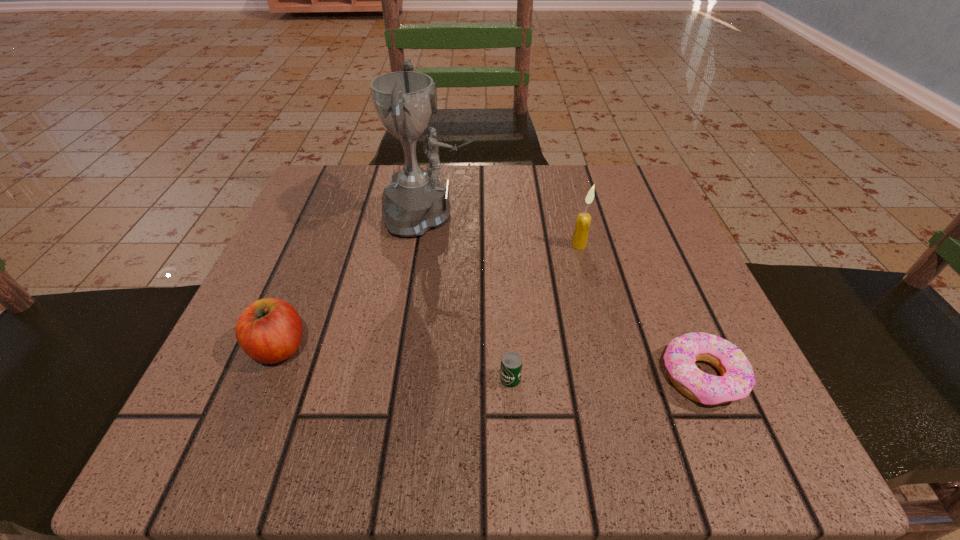
Where is `vacant space in between the doughnut and the apple`? This screenshot has height=540, width=960. vacant space in between the doughnut and the apple is located at coordinates (491, 362).

Where is `free point between the beer can and the doughnut`? Image resolution: width=960 pixels, height=540 pixels. free point between the beer can and the doughnut is located at coordinates (606, 378).

This screenshot has width=960, height=540. In order to click on free space between the candle and the tallest object in this screenshot , I will do click(x=505, y=231).

The width and height of the screenshot is (960, 540). What are the coordinates of `vacant space that's between the award and the doughnut` in the screenshot? It's located at (566, 296).

Where is `free area in between the beer can and the third shortest object`? The image size is (960, 540). free area in between the beer can and the third shortest object is located at coordinates (395, 363).

You are a GUI agent. You are given a task and a screenshot of the screen. Output one action in this format:
    pyautogui.click(x=<x>, y=<y>)
    Task: Click on the closest object to the leftmost object
    This screenshot has height=540, width=960.
    Given the screenshot: What is the action you would take?
    pyautogui.click(x=416, y=201)

Identify which object is the nearest to the candle. Please provide its 2D coordinates. Your answer should be formatted as a tuple, i.e. [(x, y)], where the tuple contains the x and y coordinates of a point satisfying the conditions above.

[(416, 201)]

The width and height of the screenshot is (960, 540). Identify the location of blank space that satisfies the following two spatial constraints: 1. on the side with emblem of the rightmost object; 2. on the right side of the award. (409, 376).

You are a GUI agent. You are given a task and a screenshot of the screen. Output one action in this format:
    pyautogui.click(x=<x>, y=<y>)
    Task: Click on the vacant space that satisfies the following two spatial constraints: 1. on the side with emblem of the fourth object from right to left; 2. on the right side of the third object from left to right
    The width and height of the screenshot is (960, 540).
    Given the screenshot: What is the action you would take?
    pyautogui.click(x=409, y=379)

The height and width of the screenshot is (540, 960). I want to click on blank space that satisfies the following two spatial constraints: 1. on the back side of the doughnut; 2. on the side with emblem of the fourth object from right to left, so click(634, 215).